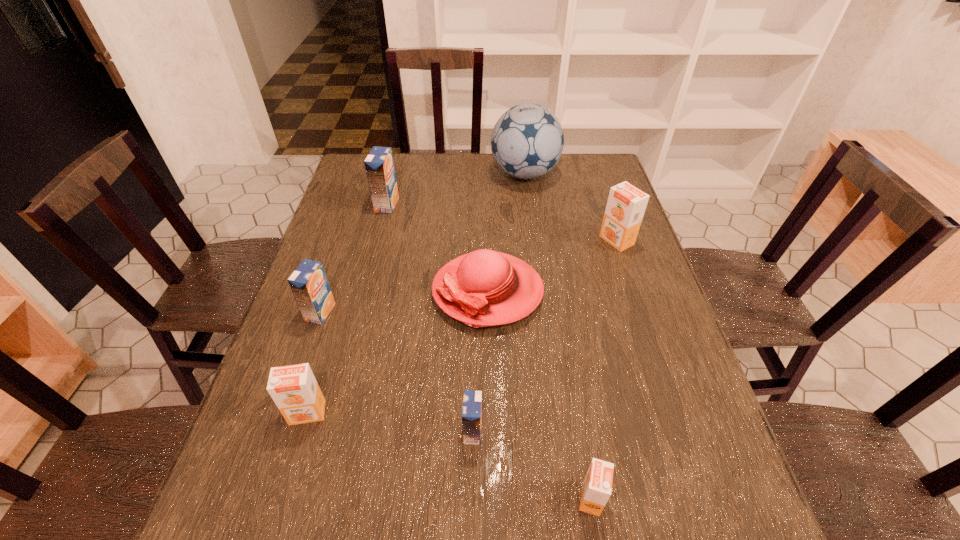
You are a GUI agent. You are given a task and a screenshot of the screen. Output one action in this format:
    pyautogui.click(x=<x>, y=<y>)
    Task: Click on the blue orange_juice that is the second closest to the second smallest blue orange_juice
    The height and width of the screenshot is (540, 960).
    Given the screenshot: What is the action you would take?
    pyautogui.click(x=472, y=399)

Identify the location of orange orange juice that stands as the second closest to the tallest object. The image size is (960, 540). (294, 389).

Locate which orange orange juice is the closest to the second nearest blue orange_juice. Please provide its 2D coordinates. Your answer should be formatted as a tuple, i.e. [(x, y)], where the tuple contains the x and y coordinates of a point satisfying the conditions above.

[(294, 389)]

Image resolution: width=960 pixels, height=540 pixels. In order to click on free space that satisfies the following two spatial constraints: 1. on the back side of the fifth orange juice from left to right; 2. on the side with brand of the farthest object in this screenshot , I will do `click(537, 174)`.

The width and height of the screenshot is (960, 540). I want to click on vacant space that satisfies the following two spatial constraints: 1. on the front side of the second biggest orange orange juice; 2. on the right side of the second smallest blue orange_juice, so point(287,413).

At what (x,y) coordinates should I click in order to perform the action: click on free spot that satisfies the following two spatial constraints: 1. at the front of the red hat with a bow; 2. on the front side of the rightmost blue orange_juice. Please return your answer as a coordinate pair (x, y). The height and width of the screenshot is (540, 960). Looking at the image, I should click on (490, 431).

The image size is (960, 540). What are the coordinates of `vacant point that satisfies the following two spatial constraints: 1. on the front side of the second biggest orange orange juice; 2. on the left side of the second smallest blue orange_juice` in the screenshot? It's located at (287, 413).